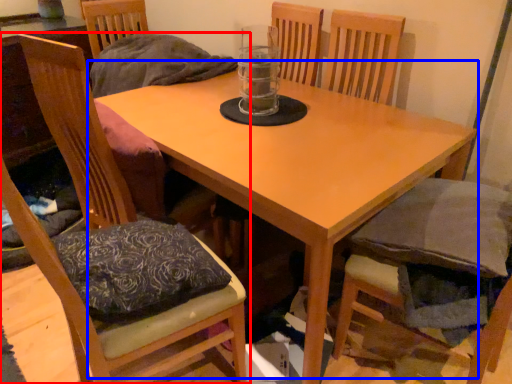
Question: Which of the following is the farthest to the observer, chair (highlighted by a red box) or table (highlighted by a blue box)?

Choices:
 (A) chair
 (B) table

Answer: (B)